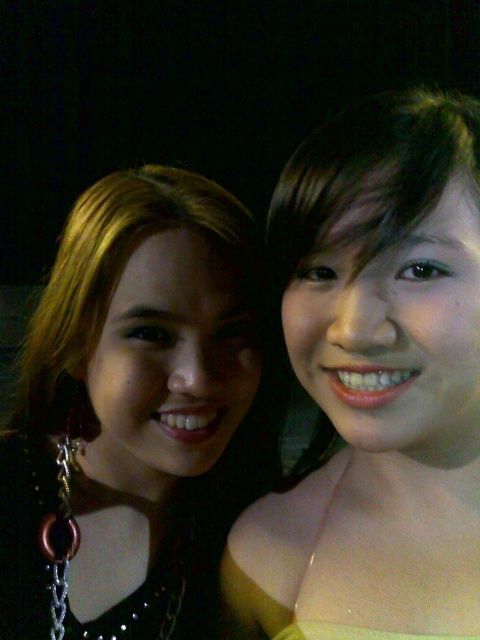
Consider the image. You are a photographer trying to adjust the lighting for a photo shoot. You need to place a spotlight at a specific coordinate to highlight the matte yellow dress at center. What are the coordinates where you should place the spotlight?

The coordinates for the matte yellow dress at center are at point (x=375, y=381), so you should place the spotlight at those coordinates to highlight it.

You are a photographer trying to adjust the focus of your camera. You have two points in the image, point (408, 456) and point (6, 524). Which point should you focus on first if you want to ensure the closest object is in focus?

Point (408, 456) is closer to the viewer than point (6, 524), so you should focus on point (408, 456) first to ensure the closest object is in focus.

You are a photographer trying to decide which outfit to recommend based on the scene. Since the background is dark, you want to ensure the outfits stand out. Which of the two items, the matte yellow dress at center or the matte black hair at left, would you suggest keeping in the photo to maximize visibility?

The matte yellow dress at center should be kept because it is shorter than the matte black hair at left, making it more noticeable against the dark background.